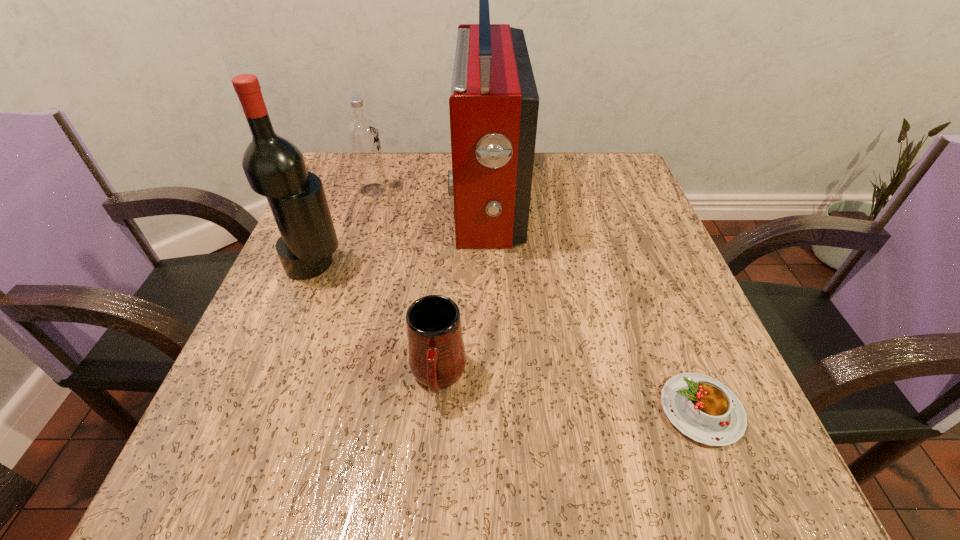
Find the location of `free spot between the rightmost object and the fourth tallest object`. free spot between the rightmost object and the fourth tallest object is located at coordinates (569, 393).

Find the location of a particular element. The width and height of the screenshot is (960, 540). empty space that is in between the shortest object and the radio receiver is located at coordinates (594, 303).

Where is `free spot between the wine bottle and the shortest object`? free spot between the wine bottle and the shortest object is located at coordinates (508, 338).

At what (x,y) coordinates should I click in order to perform the action: click on free spot between the vodka and the wine bottle. Please return your answer as a coordinate pair (x, y). The height and width of the screenshot is (540, 960). Looking at the image, I should click on (344, 227).

At what (x,y) coordinates should I click in order to perform the action: click on vacant area that lies between the mug and the pudding. Please return your answer as a coordinate pair (x, y). Looking at the image, I should click on (569, 393).

Locate an element on the screen. free space that is in between the vodka and the wine bottle is located at coordinates (344, 227).

At what (x,y) coordinates should I click in order to perform the action: click on the second closest object relative to the vodka. Please return your answer as a coordinate pair (x, y). The image size is (960, 540). Looking at the image, I should click on (274, 167).

This screenshot has width=960, height=540. In order to click on the third closest object relative to the third tallest object in this screenshot , I will do click(x=437, y=358).

Image resolution: width=960 pixels, height=540 pixels. Find the location of `free location that satisfies the following two spatial constraints: 1. on the front-facing side of the radio receiver; 2. on the side of the mug with the handle`. free location that satisfies the following two spatial constraints: 1. on the front-facing side of the radio receiver; 2. on the side of the mug with the handle is located at coordinates (491, 376).

Image resolution: width=960 pixels, height=540 pixels. What are the coordinates of `free region that satisfies the following two spatial constraints: 1. on the front side of the wine bottle; 2. on the left side of the rightmost object` in the screenshot? It's located at (256, 410).